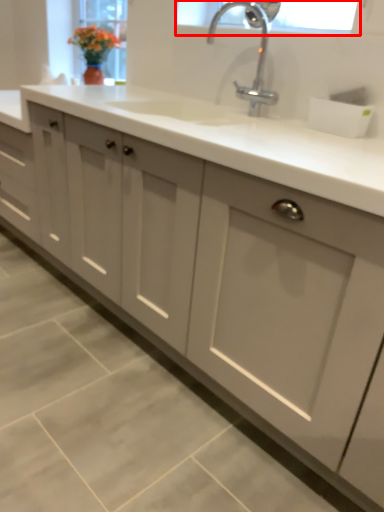
Question: From the image's perspective, where is window screen (annotated by the red box) located relative to tap?

Choices:
 (A) above
 (B) below

Answer: (A)